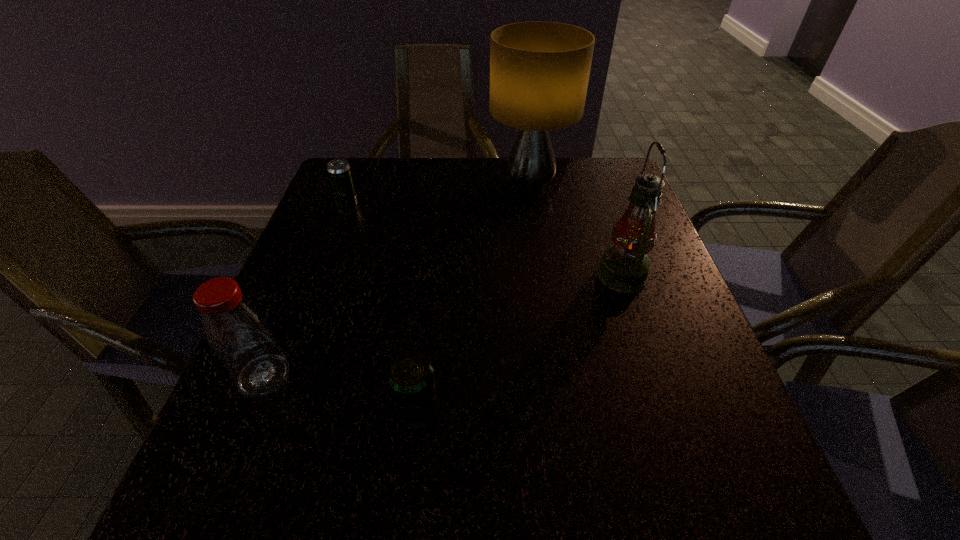
Find the location of `free space between the nearer beer can and the third farthest object`. free space between the nearer beer can and the third farthest object is located at coordinates (519, 340).

What are the coordinates of `vacant space that is in between the bottle and the lampshade` in the screenshot? It's located at (396, 281).

Find the location of a particular element. vacant point located between the shorter beer can and the left beer can is located at coordinates (382, 306).

Locate an element on the screen. unoccupied area between the second object from right to left and the shorter beer can is located at coordinates (472, 295).

Locate an element on the screen. The image size is (960, 540). free spot between the tallest object and the rightmost object is located at coordinates coord(576,231).

At what (x,y) coordinates should I click in order to perform the action: click on free spot between the bottle and the third nearest object. Please return your answer as a coordinate pair (x, y). The height and width of the screenshot is (540, 960). Looking at the image, I should click on (443, 326).

This screenshot has width=960, height=540. What are the coordinates of `object that is the second closest to the left beer can` in the screenshot? It's located at (238, 333).

Locate which object ranks third in proximity to the bottle. Please provide its 2D coordinates. Your answer should be formatted as a tuple, i.e. [(x, y)], where the tuple contains the x and y coordinates of a point satisfying the conditions above.

[(539, 71)]

The width and height of the screenshot is (960, 540). I want to click on free location that satisfies the following two spatial constraints: 1. on the front side of the left beer can; 2. on the right side of the nearer beer can, so click(x=274, y=406).

Locate an element on the screen. The height and width of the screenshot is (540, 960). free space that satisfies the following two spatial constraints: 1. on the front side of the third nearest object; 2. on the left side of the farther beer can is located at coordinates (323, 275).